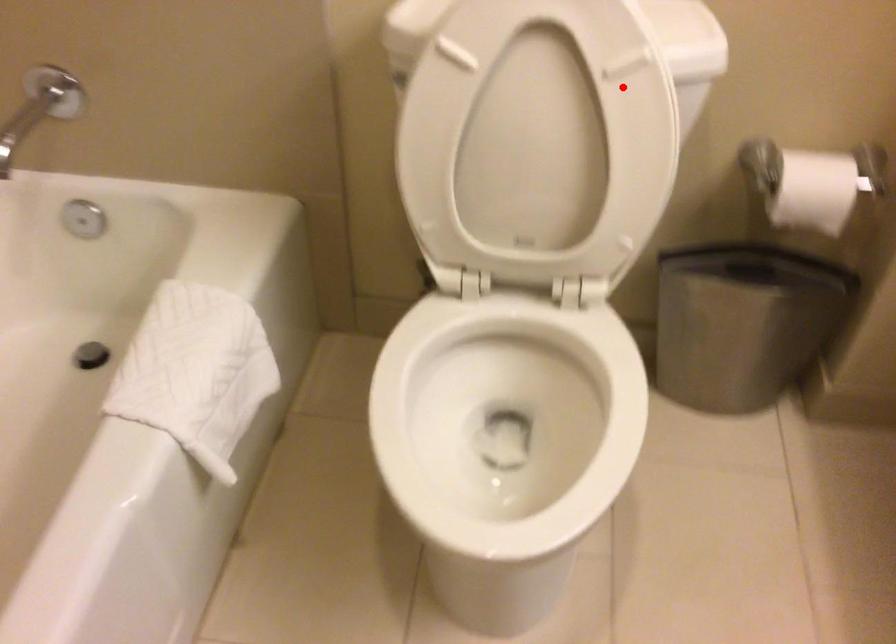
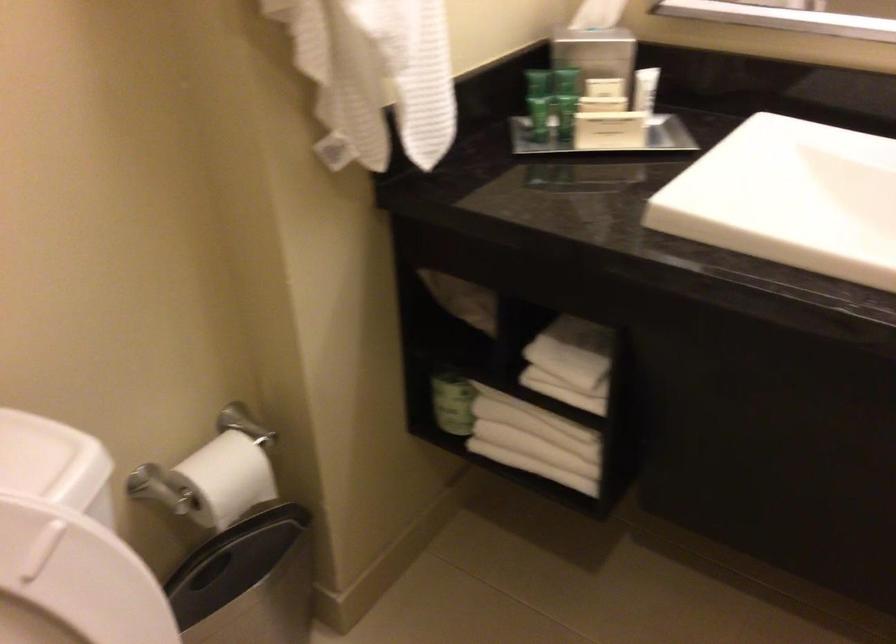
Locate, in the second image, the point that corresponds to the highlighted location in the first image.

(73, 582)